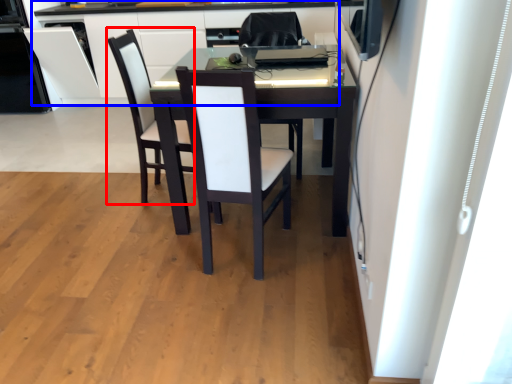
Question: Among these objects, which one is farthest to the camera, armchair (highlighted by a red box) or computer desk (highlighted by a blue box)?

Choices:
 (A) armchair
 (B) computer desk

Answer: (B)